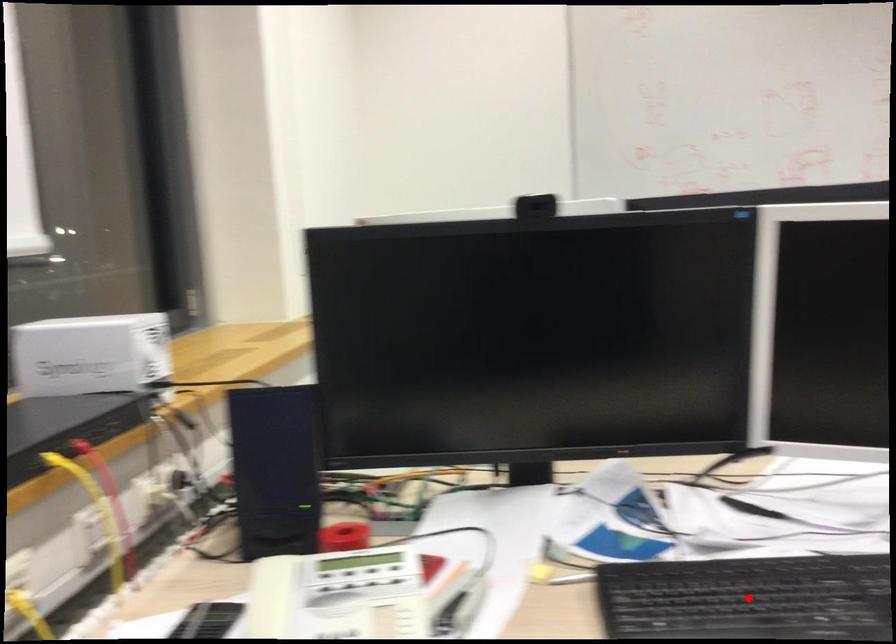
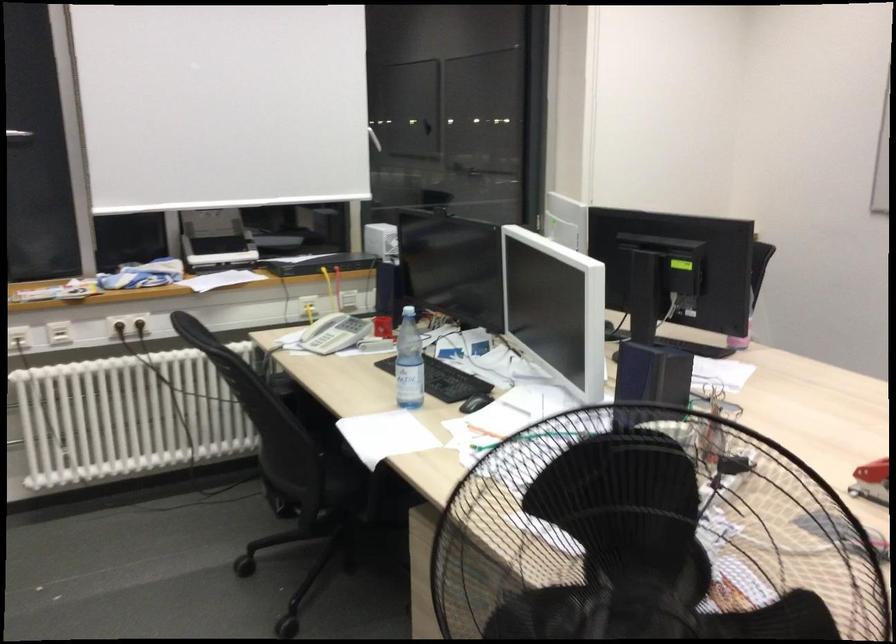
Question: I am providing you with two images of the same scene from different viewpoints. A red point is marked on the first image. At the location where the point appears in image 1, is it still visible in image 2?

Choices:
 (A) Yes
 (B) No

Answer: (B)